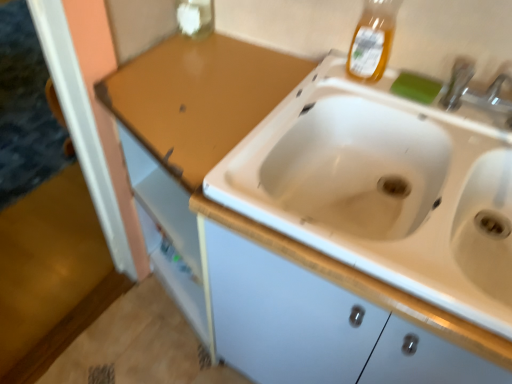
You are a GUI agent. You are given a task and a screenshot of the screen. Output one action in this format:
    pyautogui.click(x=<x>, y=<y>)
    Task: Click on the vacant area that is in front of transparent glass bottle at upper center, which is the first bottle in left-to-right order
    The image size is (512, 384).
    Given the screenshot: What is the action you would take?
    pyautogui.click(x=186, y=65)